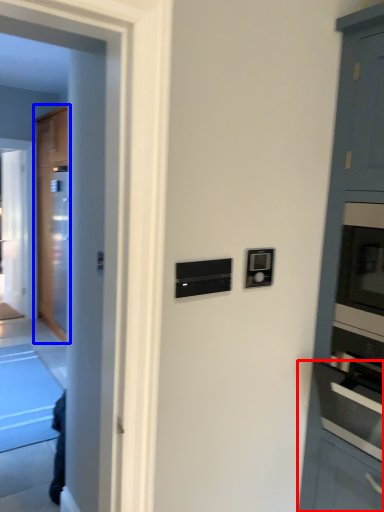
Question: Which of the following is the farthest to the observer, cabinetry (highlighted by a red box) or door (highlighted by a blue box)?

Choices:
 (A) cabinetry
 (B) door

Answer: (B)